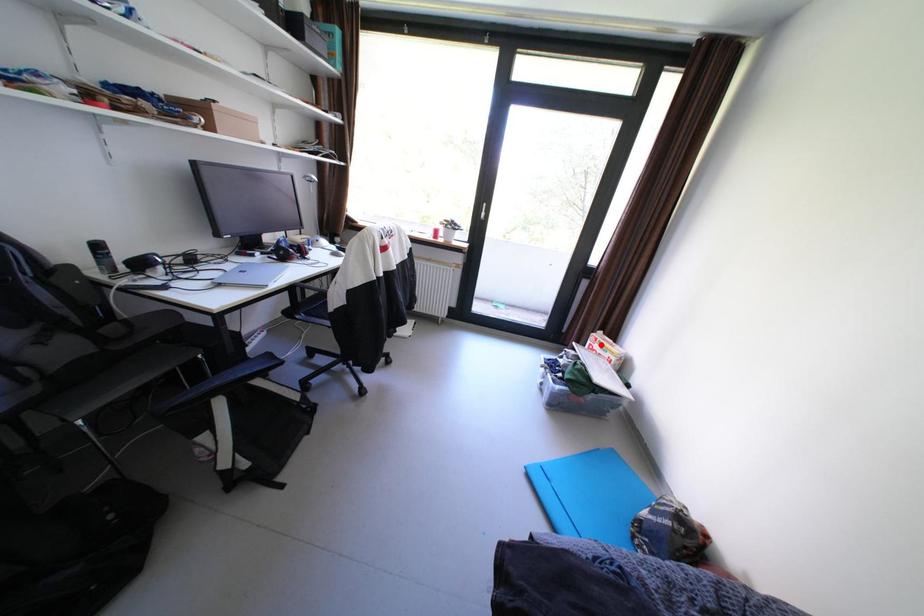
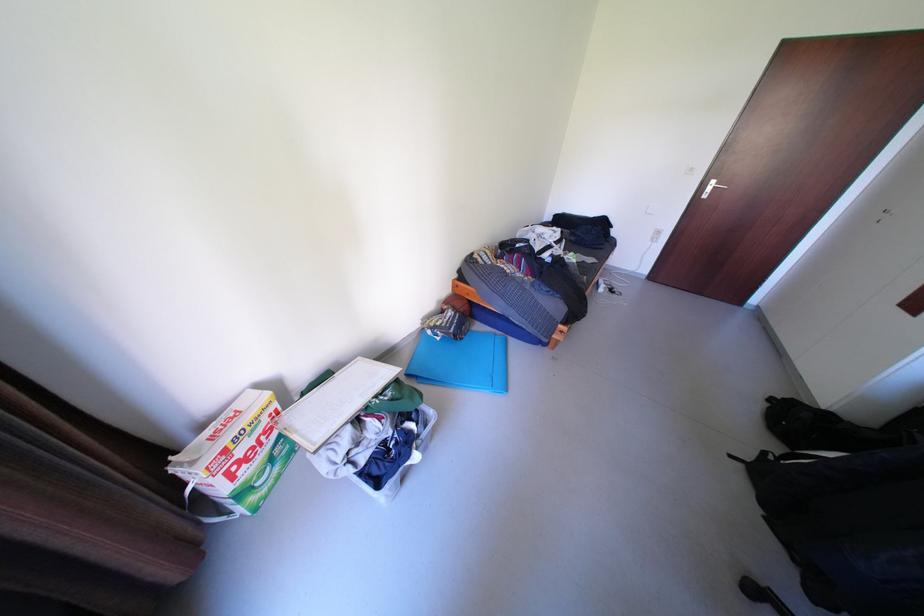
Where in the second image is the point corresponding to the highlighted location from the first image?

(237, 474)